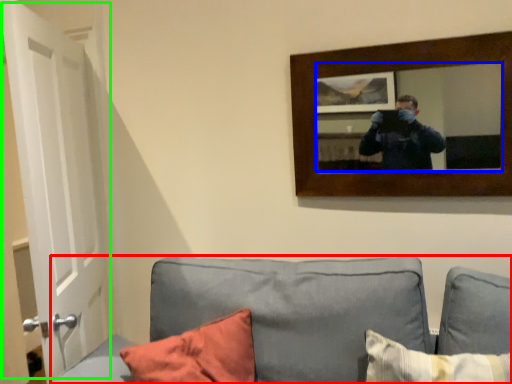
Question: Estimate the real-world distances between objects in this image. Which object is farther from studio couch (highlighted by a red box), mirror (highlighted by a blue box) or door (highlighted by a green box)?

Choices:
 (A) mirror
 (B) door

Answer: (B)